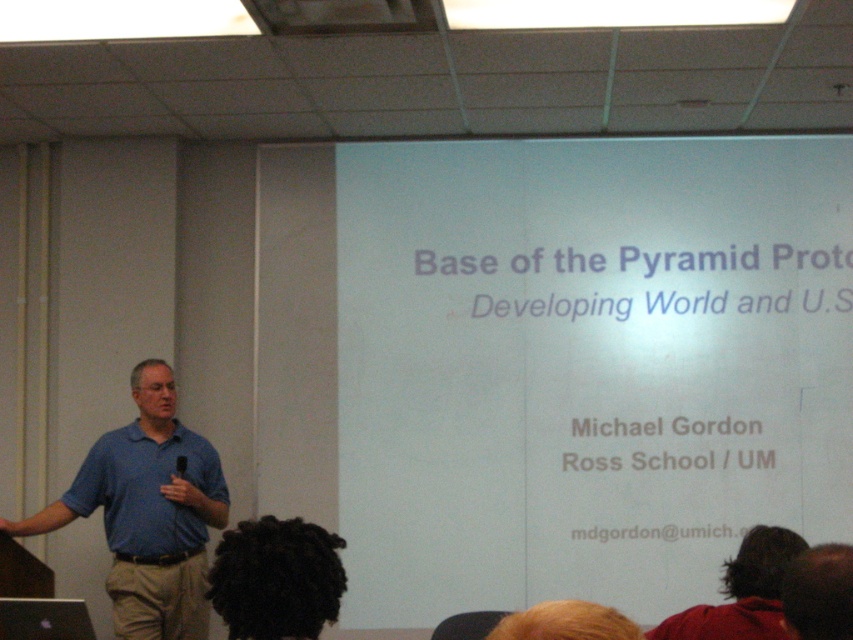
Who is higher up, white matte projection screen at upper center or black curly hair at lower center?

white matte projection screen at upper center

Is white matte projection screen at upper center smaller than black curly hair at lower center?

Incorrect, white matte projection screen at upper center is not smaller in size than black curly hair at lower center.

Is point (550, 282) positioned after point (302, 556)?

Yes, it is behind point (302, 556).

This screenshot has height=640, width=853. I want to click on white matte projection screen at upper center, so click(x=585, y=365).

Who is higher up, blue cotton shirt at left or dark red sweater at lower right?

Positioned higher is dark red sweater at lower right.

The height and width of the screenshot is (640, 853). Find the location of `blue cotton shirt at left`. blue cotton shirt at left is located at coordinates (148, 513).

Locate an element on the screen. blue cotton shirt at left is located at coordinates (148, 513).

Between blue cotton shirt at left and matte blue shirt at left, which one has less height?

matte blue shirt at left

Can you confirm if blue cotton shirt at left is thinner than matte blue shirt at left?

In fact, blue cotton shirt at left might be wider than matte blue shirt at left.

The height and width of the screenshot is (640, 853). What do you see at coordinates (148, 513) in the screenshot? I see `blue cotton shirt at left` at bounding box center [148, 513].

Locate an element on the screen. The width and height of the screenshot is (853, 640). blue cotton shirt at left is located at coordinates (148, 513).